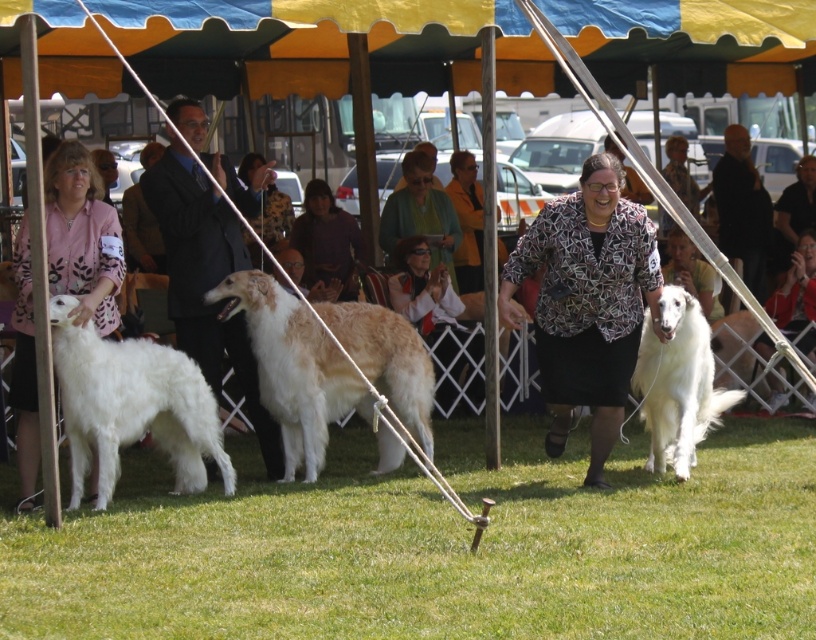
Which is behind, point (300, 310) or point (309, 195)?

The point (309, 195) is more distant.

Which of these two, golden fur dog at center or matte purple shirt at center, stands taller?

golden fur dog at center is taller.

Image resolution: width=816 pixels, height=640 pixels. Identify the location of golden fur dog at center. (293, 368).

Is golden fur dog at center thinner than dark suit at center?

No.

Which is behind, point (415, 388) or point (209, 221)?

Point (415, 388)

Is point (406, 376) positioned behind point (202, 356)?

Yes, it is.

This screenshot has width=816, height=640. I want to click on golden fur dog at center, so click(293, 368).

In the scene shown: Can you confirm if dark suit at center is wider than green textured sweater at center?

Indeed, dark suit at center has a greater width compared to green textured sweater at center.

Is dark suit at center to the left of green textured sweater at center from the viewer's perspective?

Correct, you'll find dark suit at center to the left of green textured sweater at center.

Is point (194, 317) positioned behind point (401, 172)?

That is False.

Where is `dark suit at center`? dark suit at center is located at coordinates (205, 280).